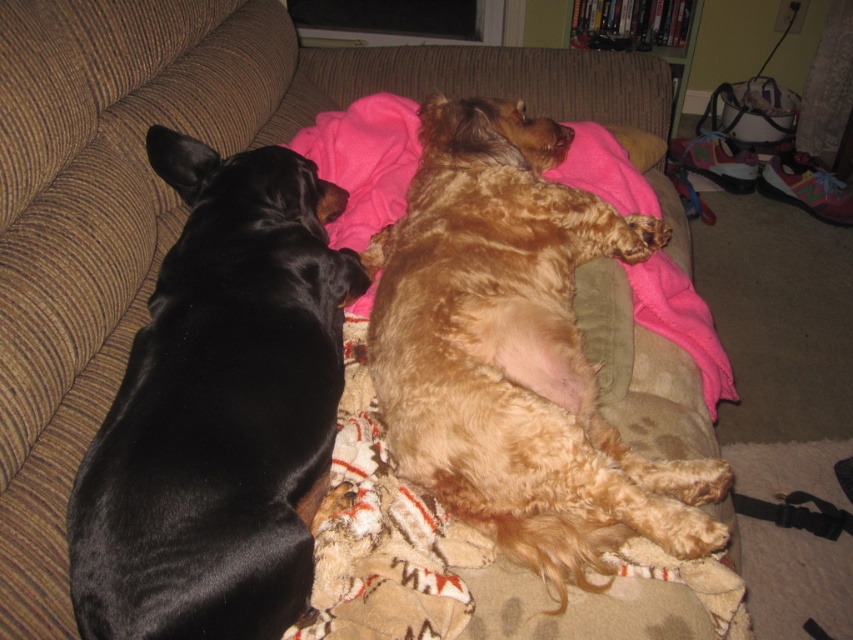
You are a dog owner who wants to place a new dog bed between the black smooth dog at left and the golden fur dog at center. Based on their current positions, which dog will require more space for the new bed?

The golden fur dog at center requires more space for the new bed because the black smooth dog at left occupies less space than the golden fur dog at center.

You are a dog owner who wants to place a small toy between the black smooth dog at left and the golden fur dog at center. Considering their heights, which dog might have an easier time reaching the toy if placed in the middle?

The golden fur dog at center is taller than the black smooth dog at left, so it might have an easier time reaching the toy placed in the middle.